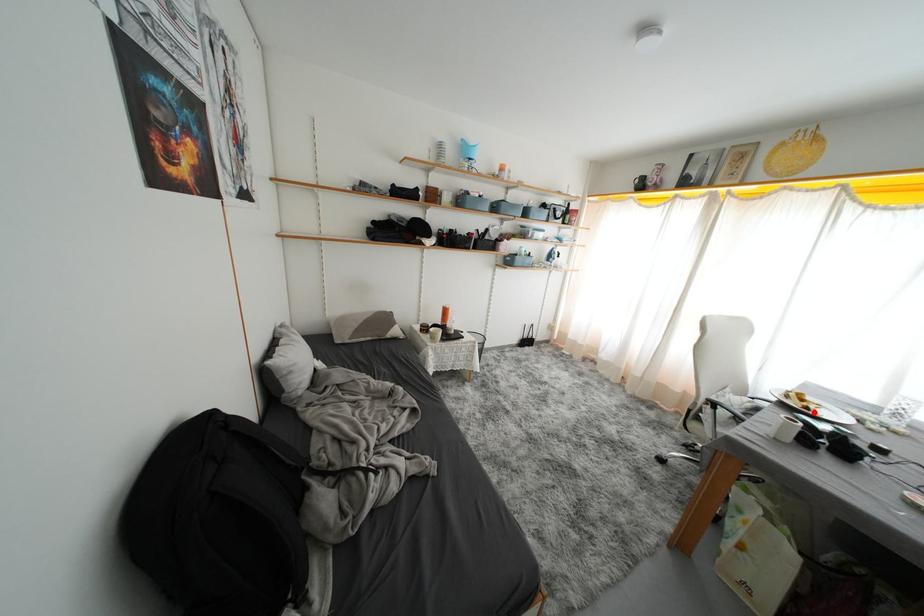
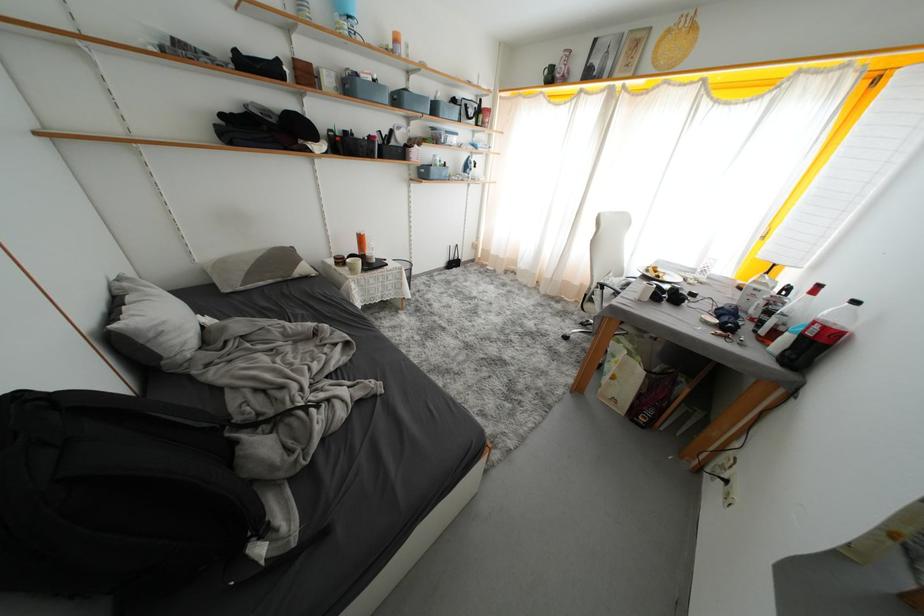
Question: I am providing you with two images of the same scene from different viewpoints. In image1, a red point is highlighted. Considering the same 3D point in image2, which of the following is correct?

Choices:
 (A) It is closer
 (B) It is farther

Answer: (A)